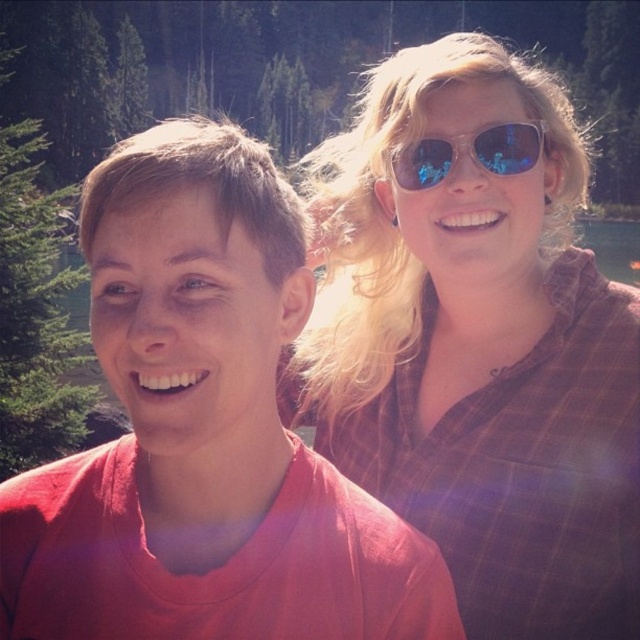
Can you confirm if plaid shirt at upper right is positioned below matte red t-shirt at center?

No.

Does plaid shirt at upper right have a lesser width compared to matte red t-shirt at center?

No.

Does point (460, 522) come in front of point (122, 218)?

No.

Where is `plaid shirt at upper right`? plaid shirt at upper right is located at coordinates (476, 340).

Can you confirm if matte red t-shirt at center is wider than sunglasses at upper right?

Yes.

Is the position of matte red t-shirt at center more distant than that of sunglasses at upper right?

No.

Between point (12, 480) and point (419, 156), which one is positioned behind?

Point (419, 156)

Where is `matte red t-shirt at center`? The width and height of the screenshot is (640, 640). matte red t-shirt at center is located at coordinates (204, 433).

Is point (388, 237) more distant than point (436, 138)?

Yes, point (388, 237) is farther from viewer.

This screenshot has width=640, height=640. Identify the location of plaid shirt at upper right. click(x=476, y=340).

What are the coordinates of `plaid shirt at upper right` in the screenshot? It's located at (476, 340).